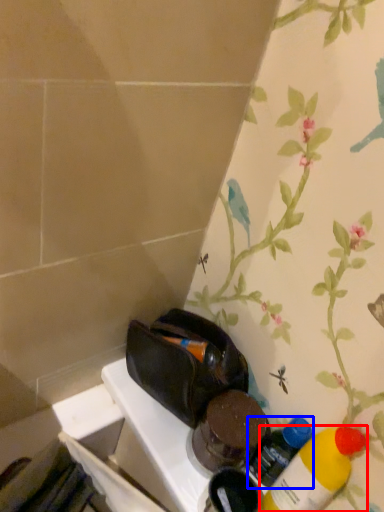
Question: Among these objects, which one is nearest to the camera, bottle (highlighted by a red box) or bottle (highlighted by a blue box)?

Choices:
 (A) bottle
 (B) bottle

Answer: (A)